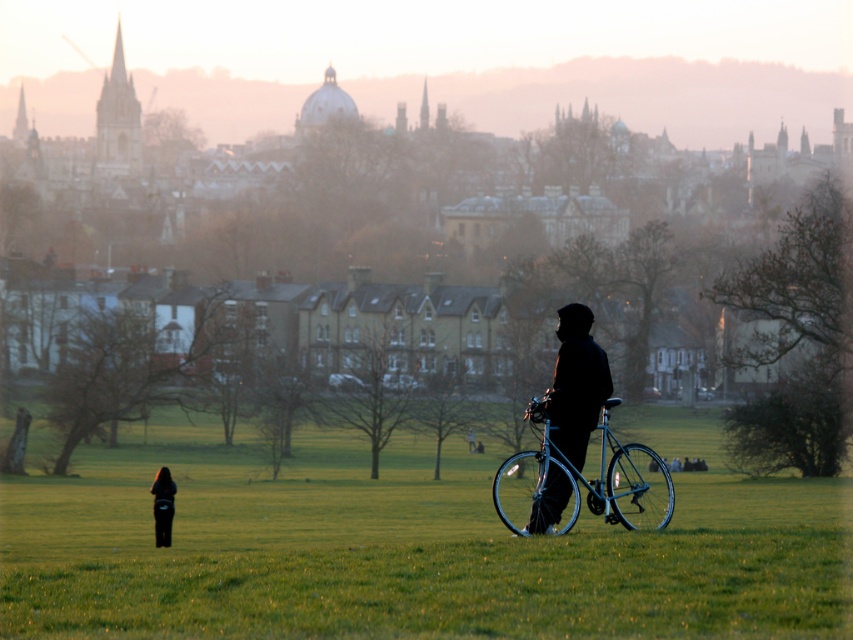
Question: Considering the relative positions of shiny blue bicycle at center and dark fabric jacket at lower left in the image provided, where is shiny blue bicycle at center located with respect to dark fabric jacket at lower left?

Choices:
 (A) right
 (B) left

Answer: (A)

Question: Which object appears farthest from the camera in this image?

Choices:
 (A) metallic bicycle at center
 (B) silhouette fabric jacket at center
 (C) dark fabric jacket at lower left
 (D) shiny blue bicycle at center

Answer: (C)

Question: Which object is closer to the camera taking this photo?

Choices:
 (A) shiny blue bicycle at center
 (B) silhouette fabric jacket at center
 (C) dark fabric jacket at lower left
 (D) metallic bicycle at center

Answer: (D)

Question: Which point is farther to the camera?

Choices:
 (A) coord(170,518)
 (B) coord(253,620)

Answer: (A)

Question: Where is metallic bicycle at center located in relation to silhouette fabric jacket at center in the image?

Choices:
 (A) right
 (B) left

Answer: (B)

Question: Can you confirm if silhouette fabric jacket at center is smaller than dark fabric jacket at lower left?

Choices:
 (A) no
 (B) yes

Answer: (A)